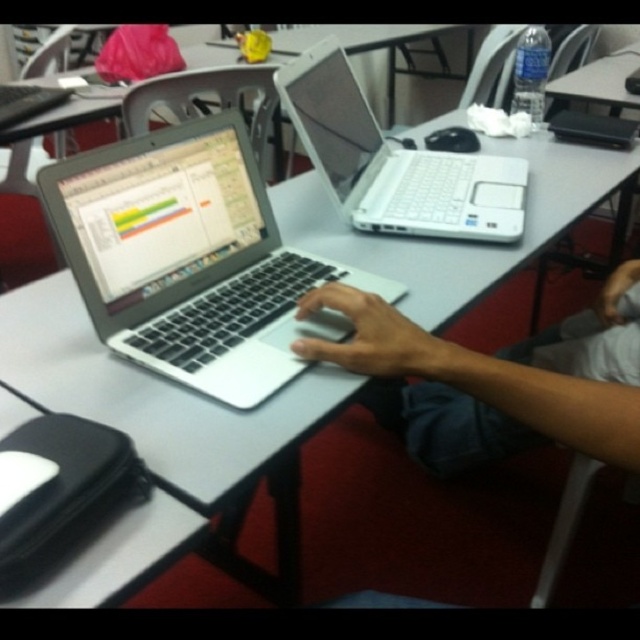
Does white plastic laptop at upper center have a larger size compared to black rubberized mouse at lower left?

Yes.

Who is positioned more to the left, white plastic laptop at upper center or black rubberized mouse at lower left?

From the viewer's perspective, black rubberized mouse at lower left appears more on the left side.

This screenshot has height=640, width=640. What are the coordinates of `white plastic laptop at upper center` in the screenshot? It's located at (394, 163).

Where is `white plastic laptop at upper center`? white plastic laptop at upper center is located at coordinates (394, 163).

From the picture: Who is more forward, [52,474] or [461,147]?

Point [52,474] is in front.

Can you confirm if black rubberized mouse at lower left is bigger than black matte mouse at center?

Actually, black rubberized mouse at lower left might be smaller than black matte mouse at center.

Measure the distance between point (8, 492) and camera.

Point (8, 492) and camera are 19.91 inches apart.

Where is `black rubberized mouse at lower left`? The image size is (640, 640). black rubberized mouse at lower left is located at coordinates (22, 484).

How distant is silver metallic laptop at center from white plastic laptop at upper center?

They are 11.32 inches apart.

Between point (131, 333) and point (419, 180), which one is positioned in front?

Positioned in front is point (131, 333).

Find the location of a particular element. Image resolution: width=640 pixels, height=640 pixels. silver metallic laptop at center is located at coordinates (189, 259).